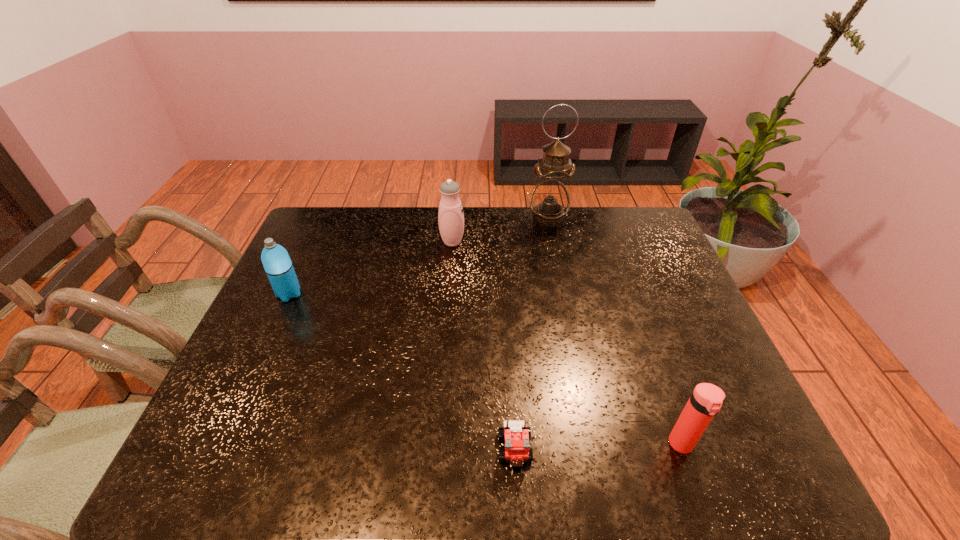
This screenshot has height=540, width=960. I want to click on object present at the near right corner, so click(705, 402).

At what (x,y) coordinates should I click in order to perform the action: click on vacant area at the far edge. Please return your answer as a coordinate pair (x, y). The width and height of the screenshot is (960, 540). Looking at the image, I should click on (500, 207).

In the image, there is a desktop. Where is `free space at the near edge`? free space at the near edge is located at coordinates (557, 450).

I want to click on free space at the left edge of the desktop, so click(x=277, y=353).

You are a GUI agent. You are given a task and a screenshot of the screen. Output one action in this format:
    pyautogui.click(x=<x>, y=<y>)
    Task: Click on the vacant point at the right edge
    This screenshot has height=540, width=960.
    Given the screenshot: What is the action you would take?
    pyautogui.click(x=636, y=275)

Identify the location of free space at the far left corner. This screenshot has width=960, height=540. (312, 215).

Where is `blank space at the near left corner of the desktop`? This screenshot has width=960, height=540. blank space at the near left corner of the desktop is located at coordinates tap(204, 444).

Image resolution: width=960 pixels, height=540 pixels. What are the coordinates of `free location at the far right corner of the desktop` in the screenshot? It's located at (644, 220).

Where is `vacant point located between the rightmost object and the second thermos bottle from left to right`? The image size is (960, 540). vacant point located between the rightmost object and the second thermos bottle from left to right is located at coordinates (566, 343).

You are a GUI agent. You are given a task and a screenshot of the screen. Output one action in this format:
    pyautogui.click(x=<x>, y=<y>)
    Task: Click on the empty location between the third object from left to right and the oil lamp
    
    Given the screenshot: What is the action you would take?
    pyautogui.click(x=532, y=334)